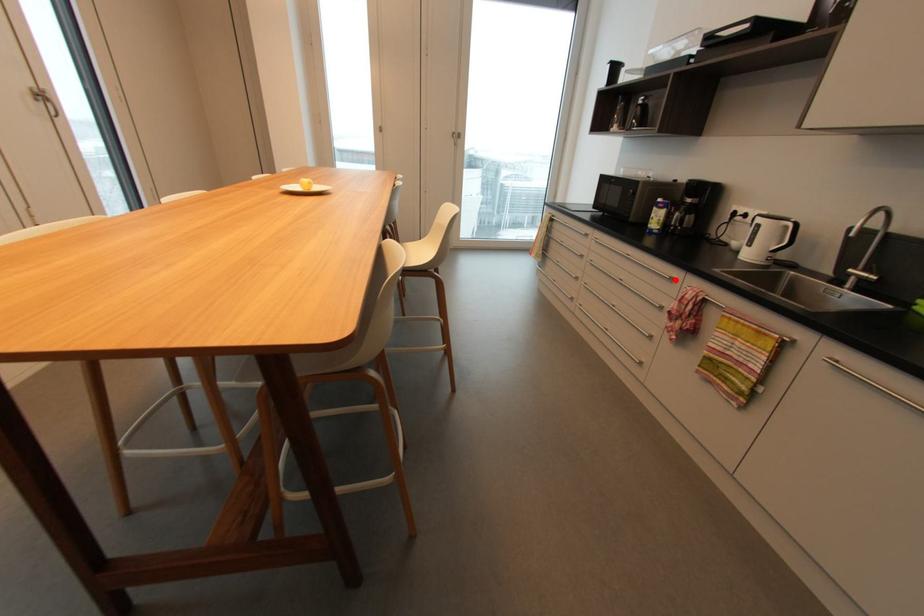
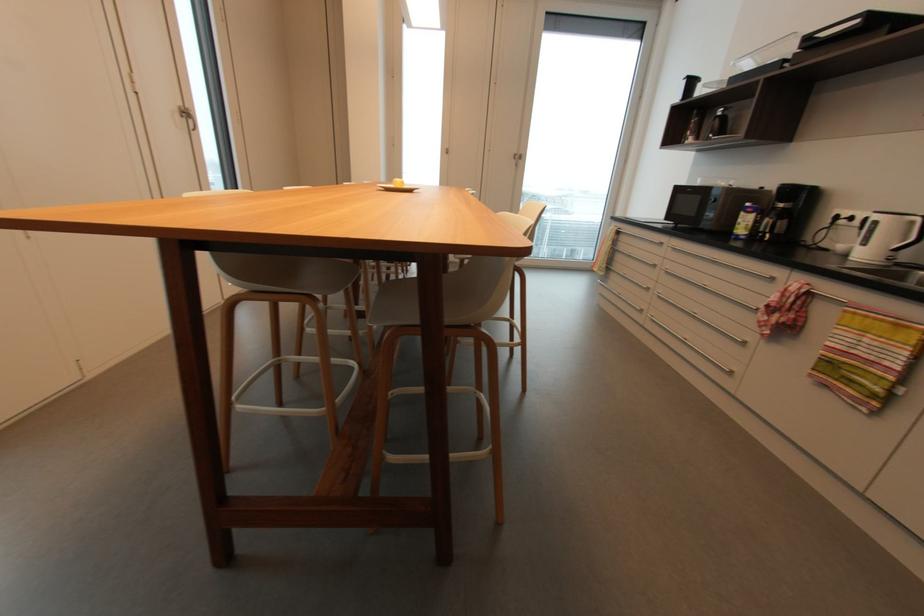
The point at the highlighted location is marked in the first image. Where is the corresponding point in the second image?

(775, 280)